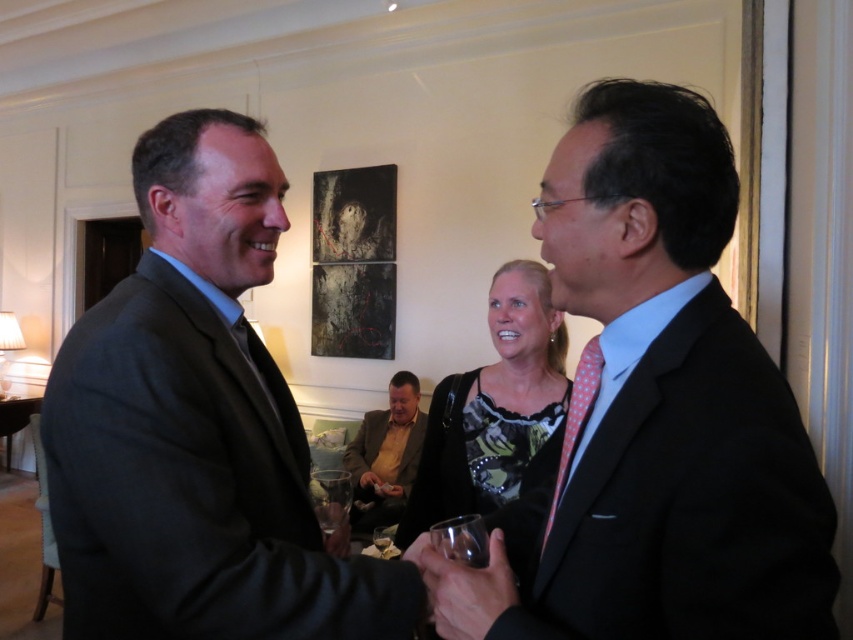
Is point (627, 337) in front of point (496, 339)?

Yes, it is.

Which is in front, point (701, 355) or point (500, 385)?

Point (701, 355)

Locate an element on the screen. polka dot tie at right is located at coordinates (666, 401).

Is printed silk blouse at center smaller than yellowish-brown textured blazer at lower center?

Yes, printed silk blouse at center is smaller than yellowish-brown textured blazer at lower center.

Does printed silk blouse at center appear on the left side of yellowish-brown textured blazer at lower center?

Incorrect, printed silk blouse at center is not on the left side of yellowish-brown textured blazer at lower center.

Is point (525, 416) farther from camera compared to point (405, 404)?

No, it is not.

At what (x,y) coordinates should I click in order to perform the action: click on printed silk blouse at center. Please return your answer as a coordinate pair (x, y). Looking at the image, I should click on (494, 410).

Does metallic glass at center have a larger size compared to pink dotted tie at center?

No, metallic glass at center is not bigger than pink dotted tie at center.

Which is more to the left, metallic glass at center or pink dotted tie at center?

metallic glass at center

The image size is (853, 640). I want to click on metallic glass at center, so click(x=467, y=589).